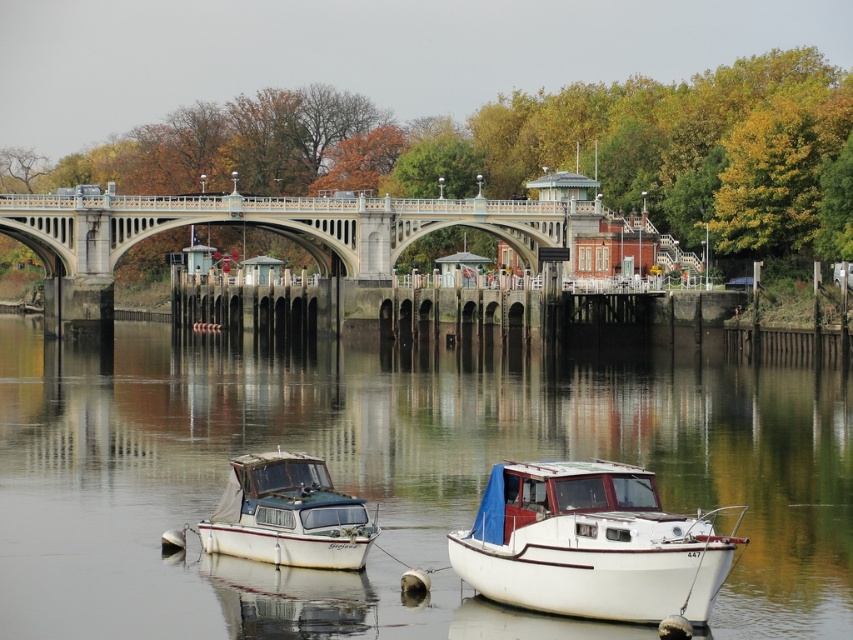
Question: Can you confirm if greenish water at center is smaller than white matte boat at lower right?

Choices:
 (A) yes
 (B) no

Answer: (B)

Question: Which object is the farthest from the greenish water at center?

Choices:
 (A) white matte boat at lower right
 (B) white matte boat at lower left

Answer: (B)

Question: Is greenish water at center to the right of white matte boat at lower right from the viewer's perspective?

Choices:
 (A) yes
 (B) no

Answer: (B)

Question: Which point appears closest to the camera in this image?

Choices:
 (A) (294, 474)
 (B) (689, 602)
 (C) (531, 417)

Answer: (B)

Question: Considering the relative positions of greenish water at center and white matte boat at lower right in the image provided, where is greenish water at center located with respect to white matte boat at lower right?

Choices:
 (A) right
 (B) left

Answer: (B)

Question: Which object is the farthest from the greenish water at center?

Choices:
 (A) white matte boat at lower left
 (B) white matte boat at lower right

Answer: (A)